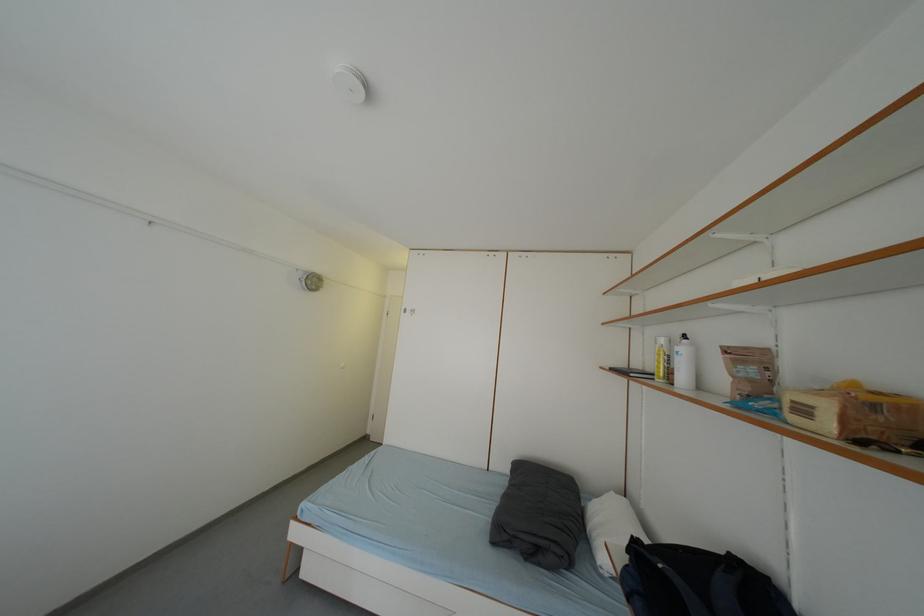
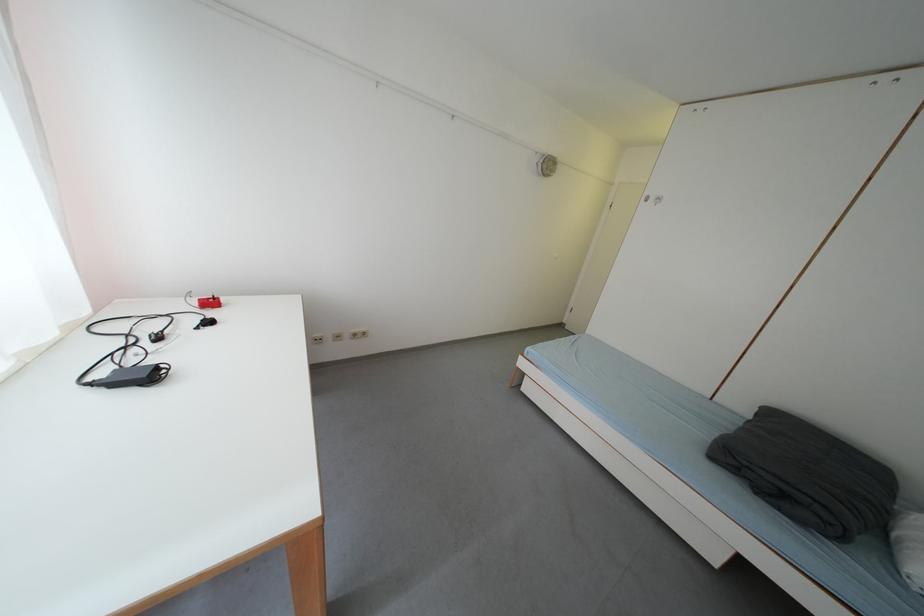
Based on the continuous images, in which direction is the camera rotating?

The camera's rotation is toward left-down.